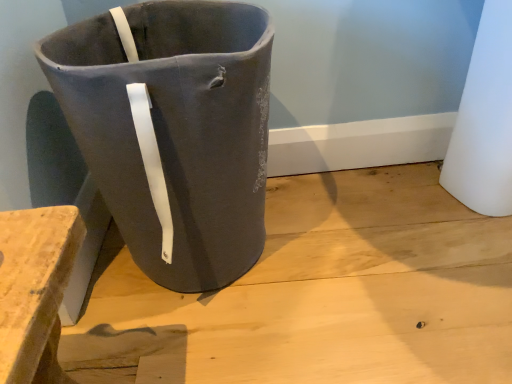
The image size is (512, 384). In order to click on vacant space to the right of matte gray fabric bag at center in this screenshot , I will do `click(352, 250)`.